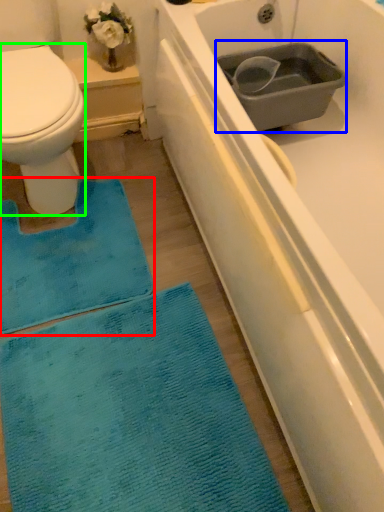
Question: Which object is positioned closest to doormat (highlighted by a red box)? Select from sink (highlighted by a blue box) and bidet (highlighted by a green box).

Choices:
 (A) sink
 (B) bidet

Answer: (B)